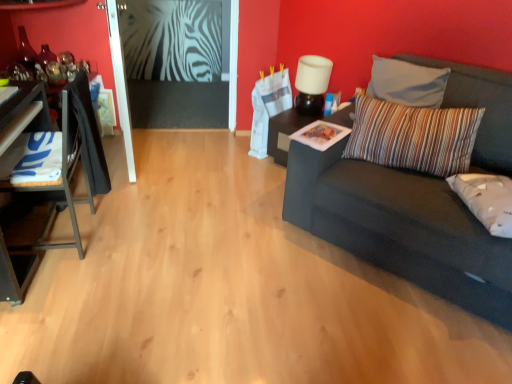
Question: Is white fabric pillow at right, which is the first pillow in bottom-to-top order, oriented towards striped fabric pillow at right, acting as the first pillow starting from the top?

Choices:
 (A) yes
 (B) no

Answer: (B)

Question: Does white fabric pillow at right, which is the first pillow in bottom-to-top order, have a lesser width compared to striped fabric pillow at right, acting as the first pillow starting from the top?

Choices:
 (A) no
 (B) yes

Answer: (A)

Question: From a real-world perspective, does white fabric pillow at right, which is the first pillow in bottom-to-top order, sit lower than striped fabric pillow at right, arranged as the second pillow when ordered from the bottom?

Choices:
 (A) yes
 (B) no

Answer: (A)

Question: Does white fabric pillow at right, which is the first pillow in bottom-to-top order, have a larger size compared to striped fabric pillow at right, acting as the first pillow starting from the top?

Choices:
 (A) yes
 (B) no

Answer: (B)

Question: Is white fabric pillow at right, which is the first pillow in bottom-to-top order, not near striped fabric pillow at right, acting as the first pillow starting from the top?

Choices:
 (A) no
 (B) yes

Answer: (A)

Question: Choose the correct answer: Is white glossy table at left, the first table from the front, inside white fabric pillow at right, acting as the 2th pillow starting from the top, or outside it?

Choices:
 (A) inside
 (B) outside

Answer: (B)

Question: From the image's perspective, relative to white fabric pillow at right, acting as the 2th pillow starting from the top, is white glossy table at left, the 2th table positioned from the right, above or below?

Choices:
 (A) below
 (B) above

Answer: (B)

Question: Is white glossy table at left, the 2th table positioned from the right, bigger or smaller than white fabric pillow at right, which is the first pillow in bottom-to-top order?

Choices:
 (A) big
 (B) small

Answer: (A)

Question: In the image, is white glossy table at left, which is counted as the 2th table, starting from the back, positioned in front of or behind white fabric pillow at right, acting as the 2th pillow starting from the top?

Choices:
 (A) behind
 (B) front

Answer: (B)

Question: In terms of width, does white glossy table at left, positioned as the first table in left-to-right order, look wider or thinner when compared to black glossy table at center, which is the second table in front-to-back order?

Choices:
 (A) thin
 (B) wide

Answer: (B)

Question: Do you think white glossy table at left, the 2th table positioned from the right, is within black glossy table at center, which is the second table in left-to-right order, or outside of it?

Choices:
 (A) inside
 (B) outside

Answer: (B)

Question: Considering the relative positions of white glossy table at left, the 2th table positioned from the right, and black glossy table at center, which is the second table in front-to-back order, in the image provided, is white glossy table at left, the 2th table positioned from the right, to the left or to the right of black glossy table at center, which is the second table in front-to-back order,?

Choices:
 (A) left
 (B) right

Answer: (A)

Question: Considering their positions, is white glossy table at left, which is counted as the 2th table, starting from the back, located in front of or behind black glossy table at center, which is the first table from right to left?

Choices:
 (A) front
 (B) behind

Answer: (A)

Question: In terms of height, does striped fabric pillow at right, arranged as the second pillow when ordered from the bottom, look taller or shorter compared to dark gray fabric couch at right?

Choices:
 (A) tall
 (B) short

Answer: (B)

Question: Relative to dark gray fabric couch at right, is striped fabric pillow at right, arranged as the second pillow when ordered from the bottom, in front or behind?

Choices:
 (A) front
 (B) behind

Answer: (B)